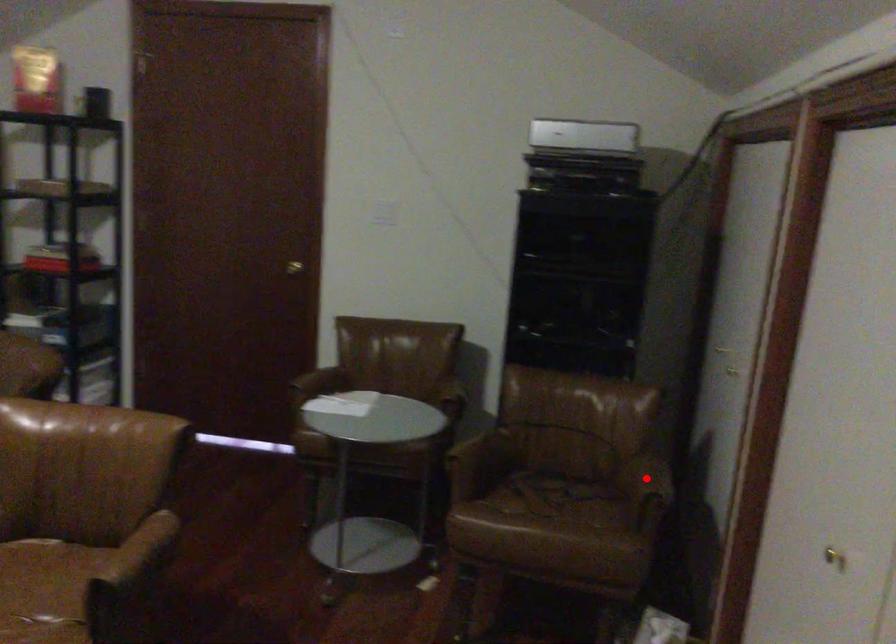
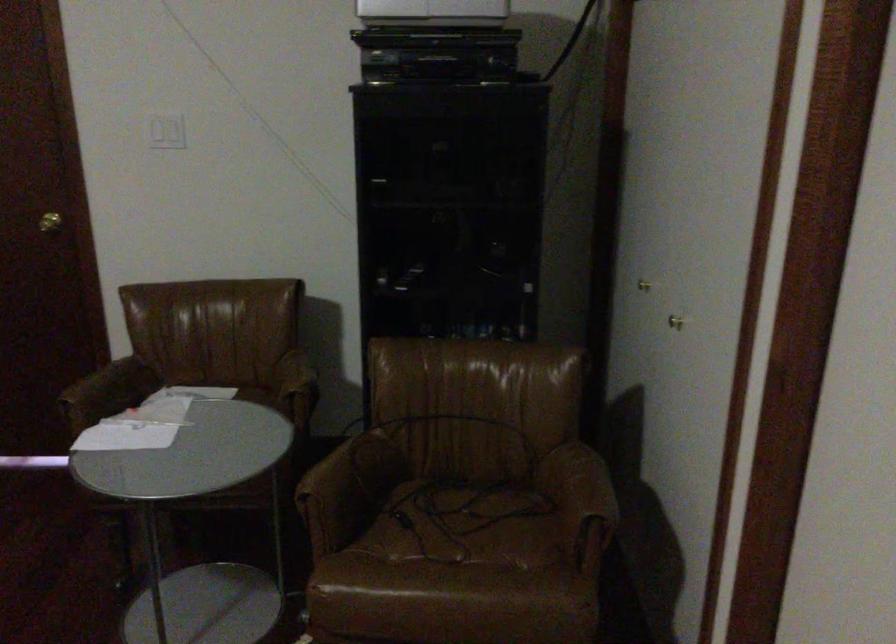
Find the pixel in the second image that matches the highlighted location in the first image.

(582, 485)